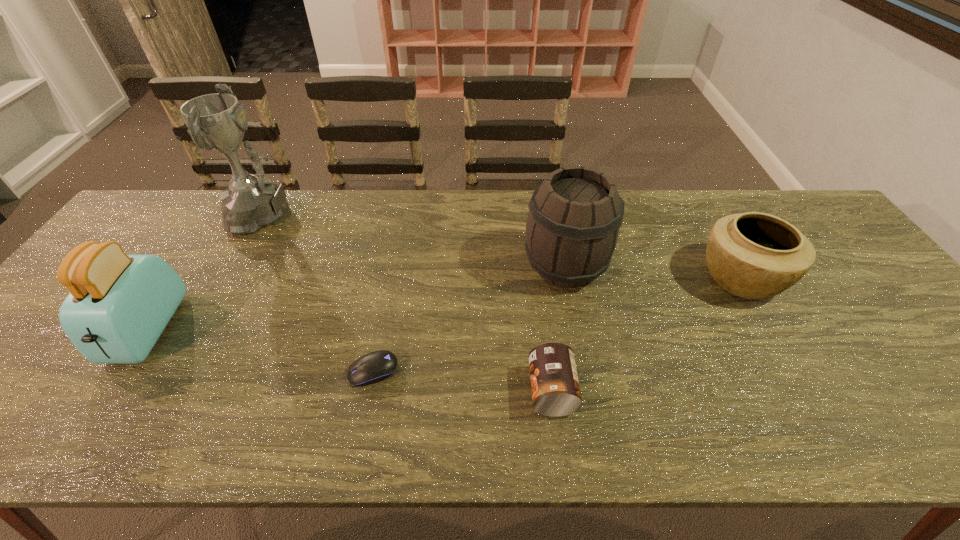
You are a GUI agent. You are given a task and a screenshot of the screen. Output one action in this format:
    pyautogui.click(x=<x>, y=<y>)
    Task: Click on the vacant area that lies between the computer mouse and the tallest object
    This screenshot has height=540, width=960.
    Given the screenshot: What is the action you would take?
    pyautogui.click(x=322, y=293)

Locate which object ranks in proximity to the fifth tallest object. Please provide its 2D coordinates. Your answer should be formatted as a tuple, i.e. [(x, y)], where the tuple contains the x and y coordinates of a point satisfying the conditions above.

[(575, 215)]

Where is `object identified as the fourth closest to the shortest object`? The height and width of the screenshot is (540, 960). object identified as the fourth closest to the shortest object is located at coordinates (217, 122).

The width and height of the screenshot is (960, 540). What are the coordinates of `free space that satisfies the following two spatial constraints: 1. on the side with emblem of the computer mouse; 2. on the left side of the tallest object` in the screenshot? It's located at (186, 371).

This screenshot has width=960, height=540. Identify the location of vacant point that satisfies the following two spatial constraints: 1. on the side with emblem of the fourth tallest object; 2. on the left side of the tallest object. 235,278.

Identify the location of vacant space that satisfies the following two spatial constraints: 1. on the side with emblem of the award; 2. on the right side of the shortest object. The height and width of the screenshot is (540, 960). (186, 371).